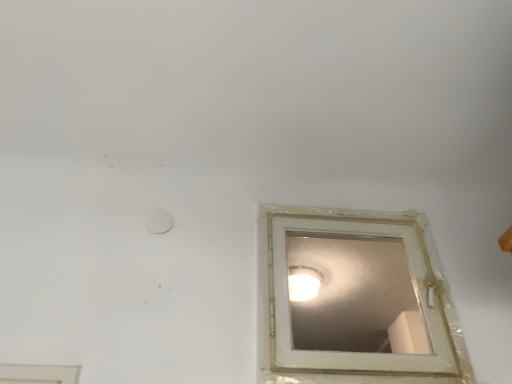
Question: Is white plastic window at center taller than white glossy light fixture at upper center?

Choices:
 (A) yes
 (B) no

Answer: (A)

Question: Does white plastic window at center have a greater width compared to white glossy light fixture at upper center?

Choices:
 (A) no
 (B) yes

Answer: (A)

Question: Does white plastic window at center have a lesser width compared to white glossy light fixture at upper center?

Choices:
 (A) no
 (B) yes

Answer: (B)

Question: Is white plastic window at center to the right of white glossy light fixture at upper center from the viewer's perspective?

Choices:
 (A) yes
 (B) no

Answer: (A)

Question: From the image's perspective, would you say white plastic window at center is shown under white glossy light fixture at upper center?

Choices:
 (A) yes
 (B) no

Answer: (B)

Question: Is white plastic window at center smaller than white glossy light fixture at upper center?

Choices:
 (A) yes
 (B) no

Answer: (B)

Question: Is white glossy light fixture at upper center oriented away from white plastic window at center?

Choices:
 (A) no
 (B) yes

Answer: (A)

Question: Is white glossy light fixture at upper center not close to white plastic window at center?

Choices:
 (A) no
 (B) yes

Answer: (A)

Question: Is white glossy light fixture at upper center at the right side of white plastic window at center?

Choices:
 (A) no
 (B) yes

Answer: (A)

Question: Is white glossy light fixture at upper center directly adjacent to white plastic window at center?

Choices:
 (A) no
 (B) yes

Answer: (A)

Question: Considering the relative positions of white glossy light fixture at upper center and white plastic window at center in the image provided, is white glossy light fixture at upper center to the left of white plastic window at center from the viewer's perspective?

Choices:
 (A) no
 (B) yes

Answer: (B)

Question: From the image's perspective, is white glossy light fixture at upper center below white plastic window at center?

Choices:
 (A) yes
 (B) no

Answer: (A)

Question: From their relative heights in the image, would you say white plastic window at center is taller or shorter than white glossy light fixture at upper center?

Choices:
 (A) short
 (B) tall

Answer: (B)